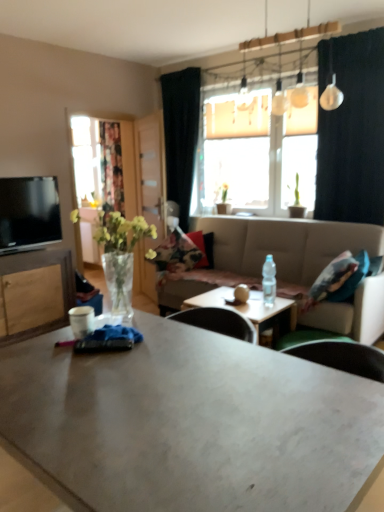
Find the location of a particular element. free spot above black fabric curtain at upper right, arranged as the second curtain when viewed from the left (from a real-world perspective) is located at coordinates (358, 26).